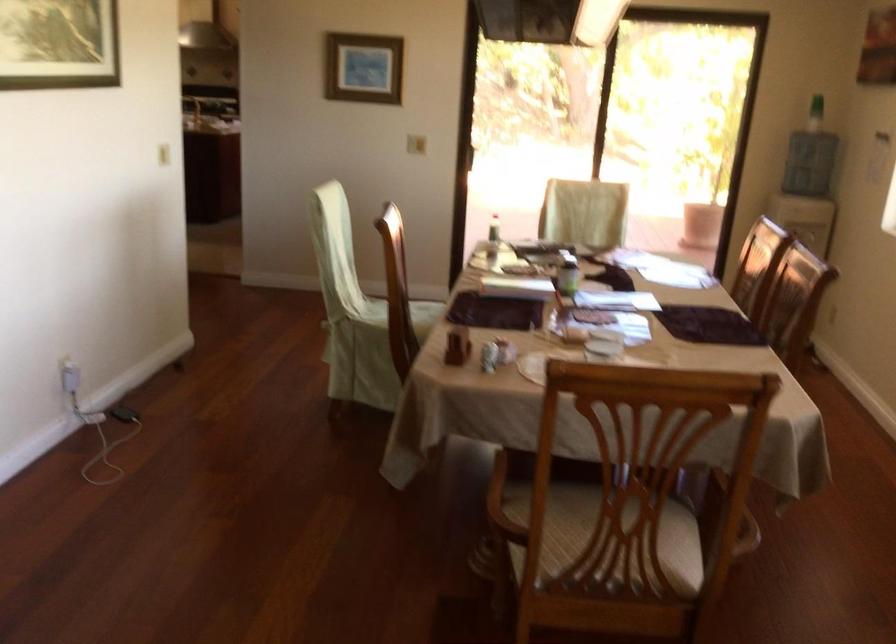
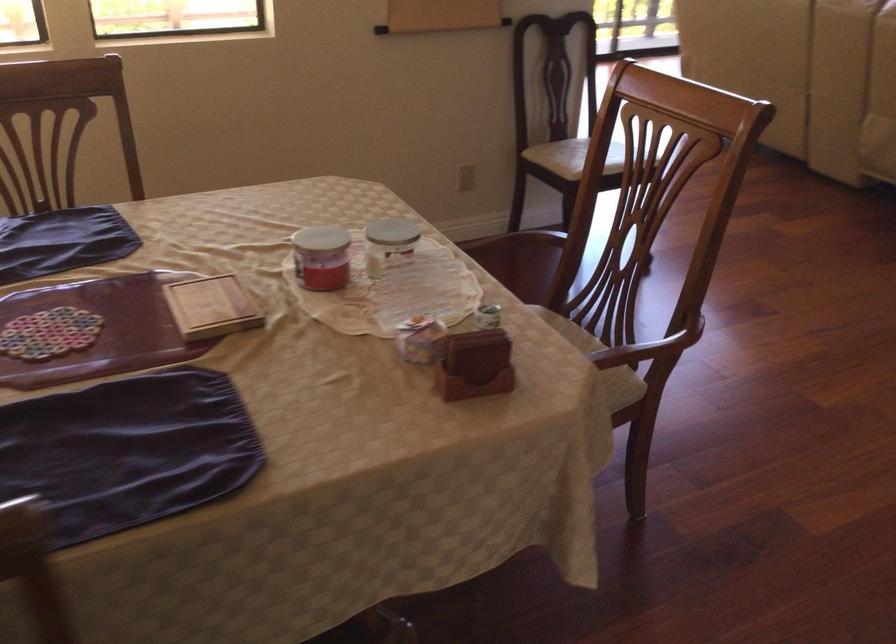
In the second image, find the point that corresponds to point (455, 341) in the first image.

(475, 365)